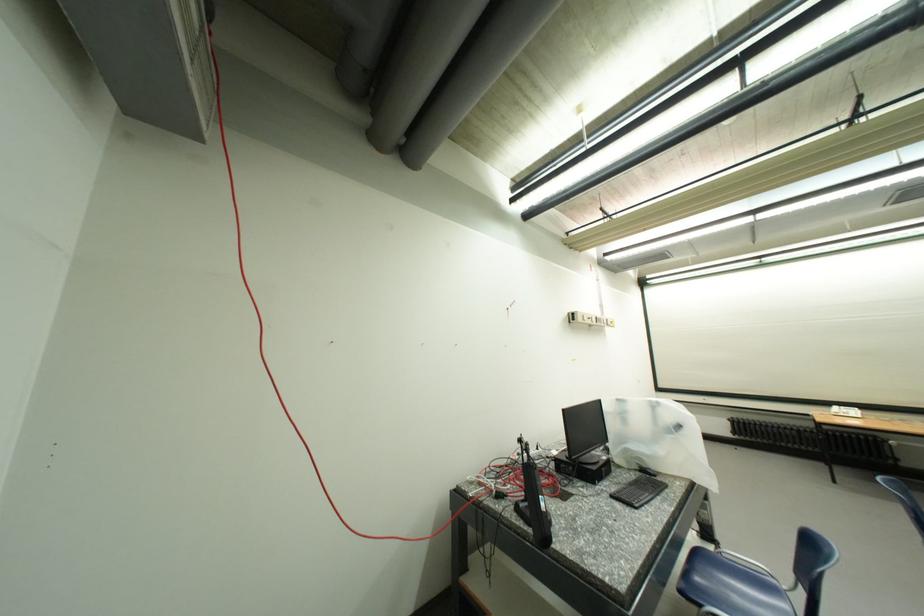
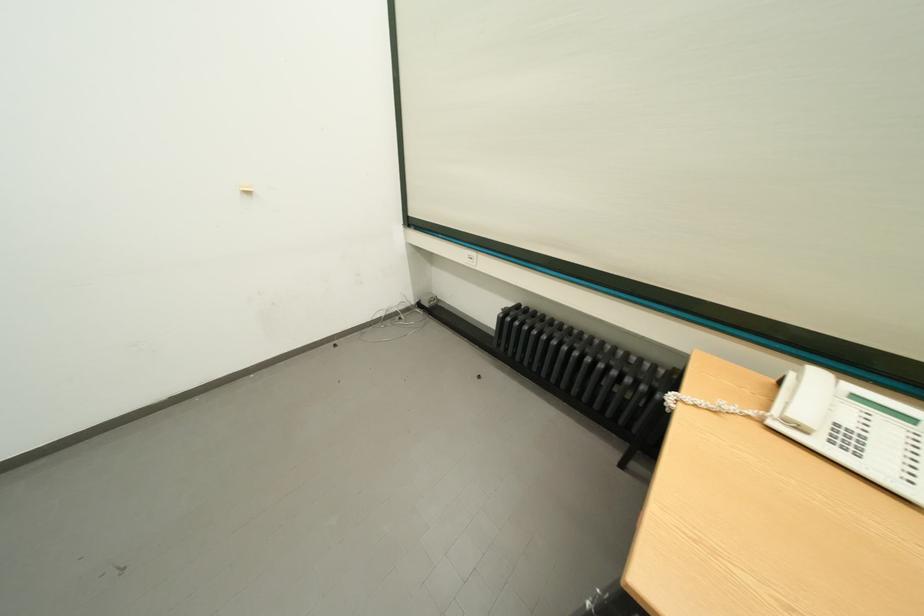
The point at (845, 415) is marked in the first image. Where is the corresponding point in the second image?

(809, 430)